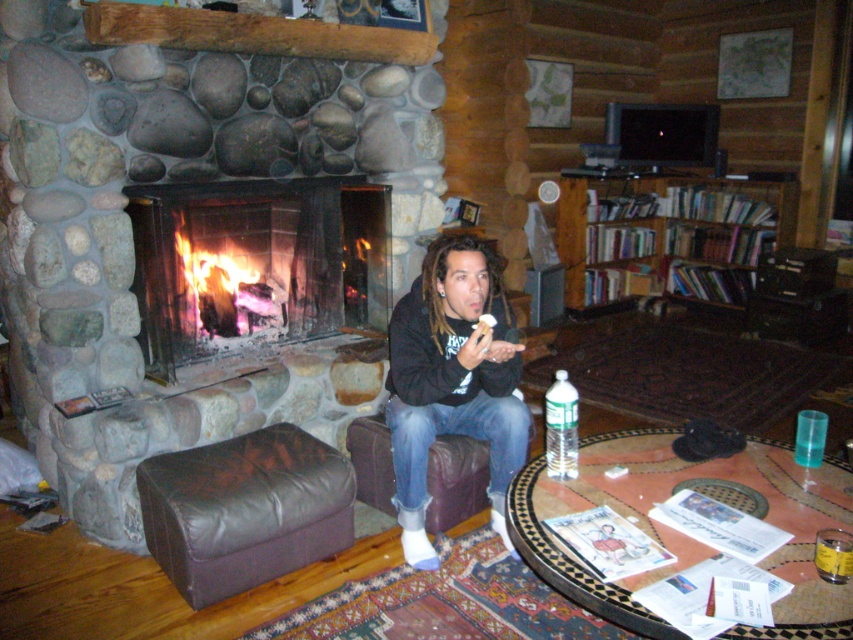
Question: Which of the following is the closest to the observer?

Choices:
 (A) wooden bookshelf at upper right
 (B) brown leather ottoman at lower center

Answer: (B)

Question: Which object is farther from the camera taking this photo?

Choices:
 (A) clear plastic water bottle at lower right
 (B) black fleece jacket at center
 (C) wooden bookshelf at upper right
 (D) brown leather ottoman at lower center

Answer: (C)

Question: Which point is farther to the camera?

Choices:
 (A) clear plastic water bottle at lower right
 (B) wooden bookshelf at upper right
 (C) brown leather ottoman at lower center
 (D) wooden fireplace at center

Answer: (B)

Question: Does brown leather ottoman at lower center appear on the right side of black fleece jacket at center?

Choices:
 (A) yes
 (B) no

Answer: (B)

Question: Where is brown leather ottoman at lower center located in relation to wooden bookshelf at upper right in the image?

Choices:
 (A) below
 (B) above

Answer: (A)

Question: Considering the relative positions of brown leather ottoman at lower center and wooden bookshelf at upper right in the image provided, where is brown leather ottoman at lower center located with respect to wooden bookshelf at upper right?

Choices:
 (A) right
 (B) left

Answer: (B)